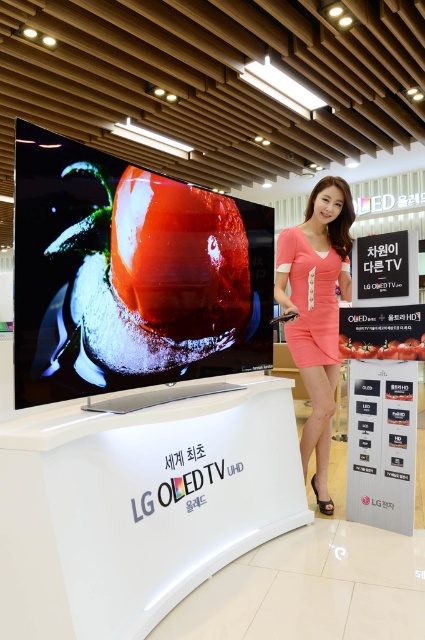
Question: Is pink fabric dress at center bigger than pink satin dress at center?

Choices:
 (A) yes
 (B) no

Answer: (A)

Question: Which point is farther from the camera taking this photo?

Choices:
 (A) (329, 355)
 (B) (323, 269)

Answer: (A)

Question: Among these points, which one is farthest from the camera?

Choices:
 (A) (320, 321)
 (B) (312, 310)

Answer: (A)

Question: Is pink fabric dress at center to the right of pink satin dress at center from the viewer's perspective?

Choices:
 (A) no
 (B) yes

Answer: (A)

Question: Is pink fabric dress at center positioned behind pink satin dress at center?

Choices:
 (A) yes
 (B) no

Answer: (B)